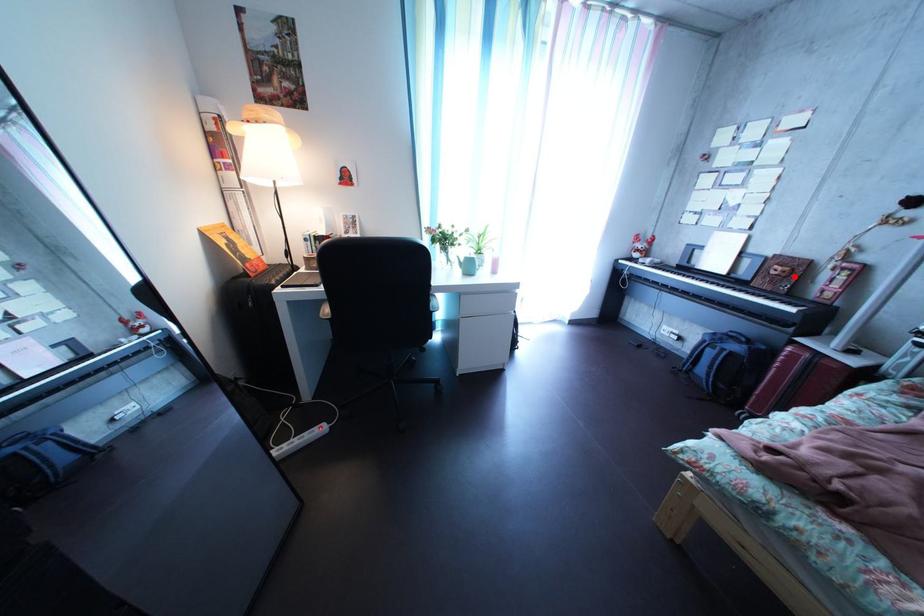
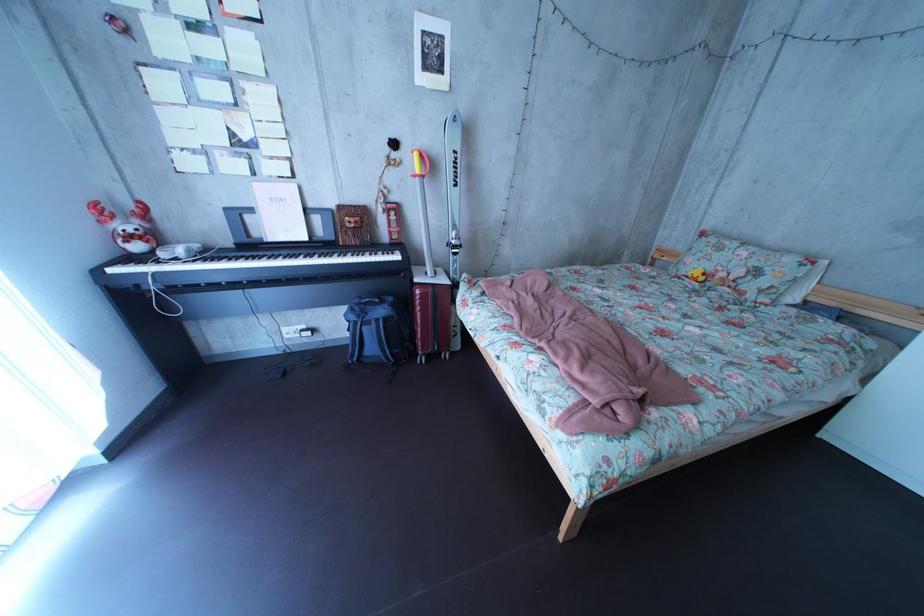
Question: I am providing you with two images of the same scene from different viewpoints. Given a red point in image1, look at the same physical point in image2. Is it:

Choices:
 (A) Closer to the viewpoint
 (B) Farther from the viewpoint

Answer: (A)